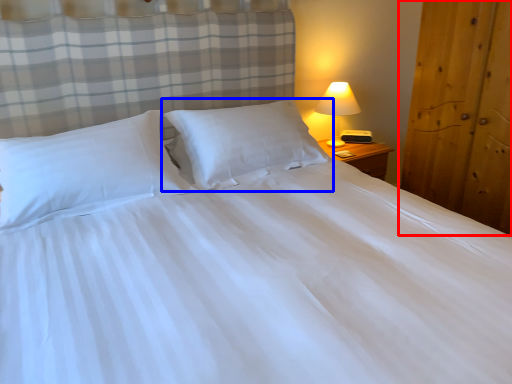
Question: Which object is closer to the camera taking this photo, armoire (highlighted by a red box) or pillow (highlighted by a blue box)?

Choices:
 (A) armoire
 (B) pillow

Answer: (A)